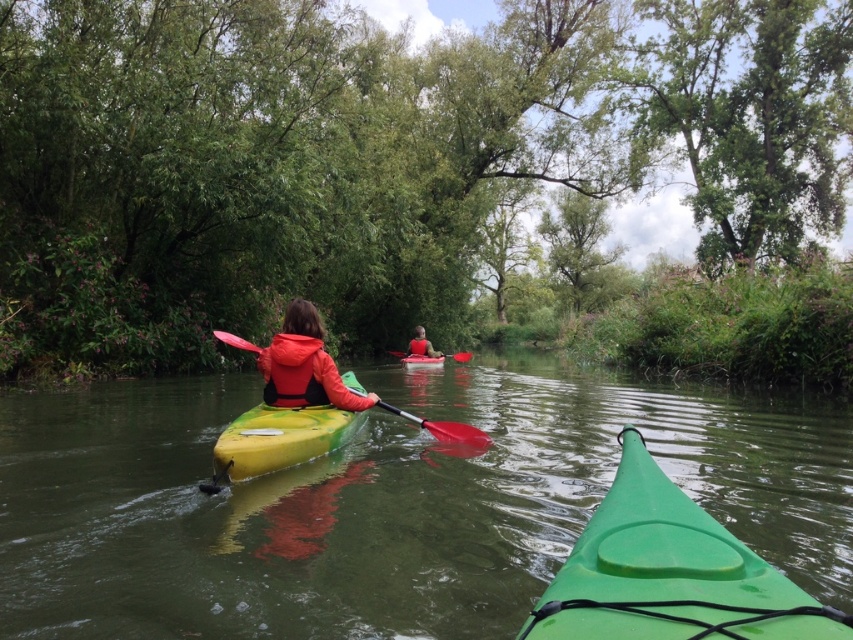
You are a safety inspector evaluating the kayaking scene. You notice the matte red life vest at center and the yellow plastic canoe at center. Which object is narrower in width?

The matte red life vest at center has a lesser width compared to the yellow plastic canoe at center, so it is narrower.

You are a kayaker trying to reach the red kayak ahead of you. You have a 24 inch long paddle. Can you safely reach the yellow plastic canoe at center with your paddle while staying in your current position near the matte red life vest at center?

The distance between the matte red life vest at center and the yellow plastic canoe at center is 25.82 inches. Since your paddle is 24 inches long, you cannot safely reach the yellow plastic canoe at center as the paddle is shorter than the required distance.

You are a kayaker in the scene and want to know the distance between your position and the point at coordinates point (421, 364). Can you determine the distance?

The distance between point (421, 364) and the camera is 23.01 meters, so the distance between your position and the point at coordinates point (421, 364) is 23.01 meters.